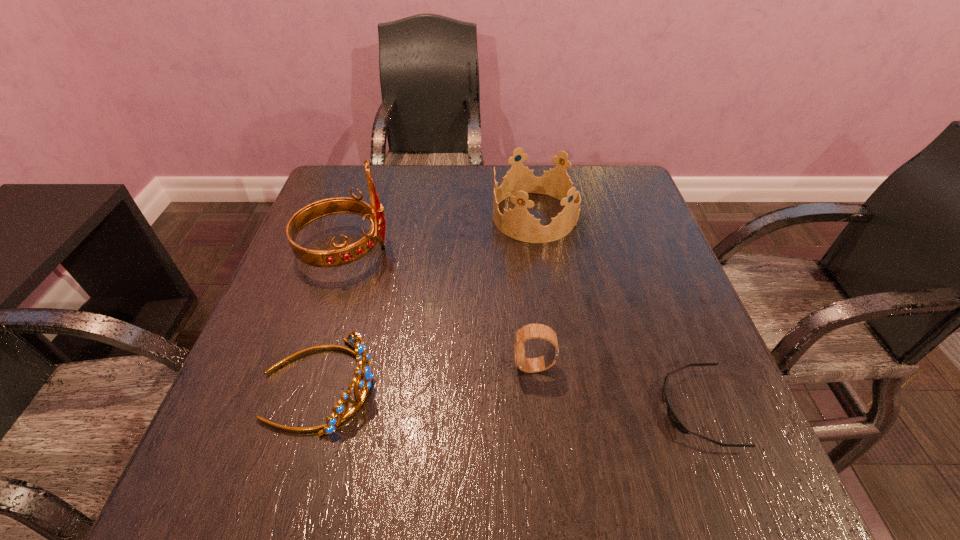
Image resolution: width=960 pixels, height=540 pixels. I want to click on free space between the tallest object and the shortest tiara, so click(x=331, y=318).

Locate an element on the screen. free space between the shortest tiara and the watch is located at coordinates (426, 376).

This screenshot has width=960, height=540. What are the coordinates of `free space between the shortest tiara and the watch` in the screenshot? It's located at (426, 376).

I want to click on vacant area that lies between the sunglasses and the second shortest tiara, so click(615, 312).

This screenshot has width=960, height=540. What are the coordinates of `free space between the sunglasses and the nearest tiara` in the screenshot? It's located at (508, 396).

Where is `free area in between the shortest tiara and the shortest object`? Image resolution: width=960 pixels, height=540 pixels. free area in between the shortest tiara and the shortest object is located at coordinates (508, 396).

Where is `free space between the tallest object and the watch`? Image resolution: width=960 pixels, height=540 pixels. free space between the tallest object and the watch is located at coordinates (440, 308).

Identify which object is the closest to the tallest tiara. Please provide its 2D coordinates. Your answer should be formatted as a tuple, i.e. [(x, y)], where the tuple contains the x and y coordinates of a point satisfying the conditions above.

[(354, 339)]

Select which object is the fourth closest to the rightmost object. Please provide its 2D coordinates. Your answer should be formatted as a tuple, i.e. [(x, y)], where the tuple contains the x and y coordinates of a point satisfying the conditions above.

[(343, 255)]

Identify which tiara is located as the third nearest to the shortest object. Please provide its 2D coordinates. Your answer should be formatted as a tuple, i.e. [(x, y)], where the tuple contains the x and y coordinates of a point satisfying the conditions above.

[(343, 255)]